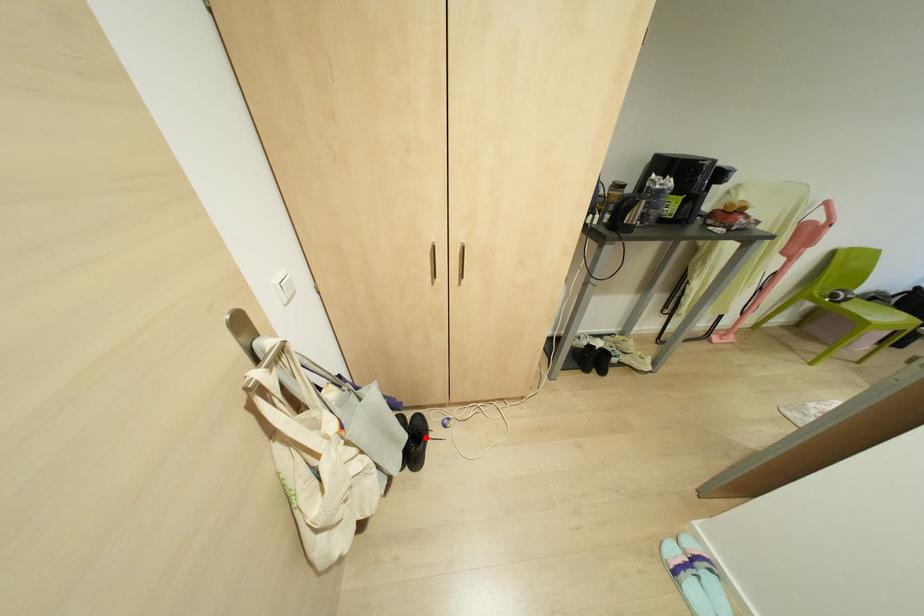
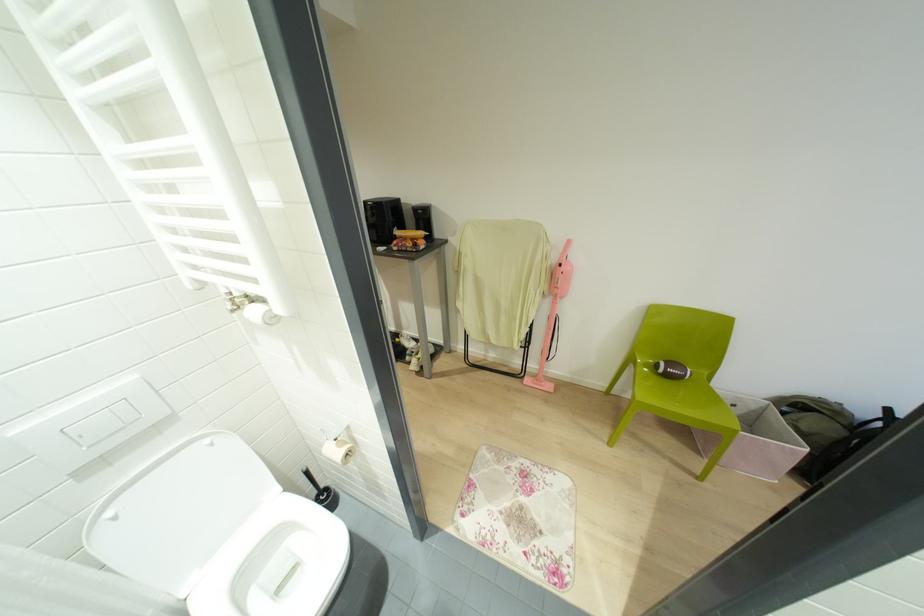
Question: I am providing you with two images of the same scene from different viewpoints. A red point is marked on the first image. Is the red point's position out of view in image 2?

Choices:
 (A) Yes
 (B) No

Answer: (A)